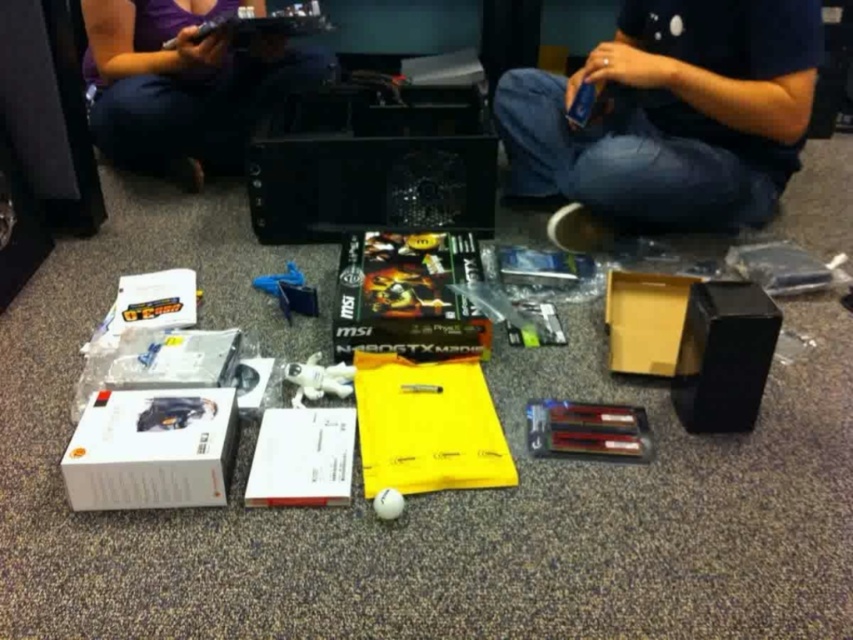
Question: In this image, where is matte purple shirt at upper left located relative to white plastic astronaut at center?

Choices:
 (A) right
 (B) left

Answer: (B)

Question: Estimate the real-world distances between objects in this image. Which object is farther from the blue plastic toy at center?

Choices:
 (A) blue denim jeans at lower right
 (B) matte purple shirt at upper left
 (C) white rubber ball at center

Answer: (A)

Question: Which point appears farthest from the camera in this image?

Choices:
 (A) (396, 493)
 (B) (730, 125)

Answer: (B)

Question: Which is nearer to the matte purple shirt at upper left?

Choices:
 (A) white plastic astronaut at center
 (B) blue plastic toy at center
 (C) white rubber ball at center
 (D) blue denim jeans at lower right

Answer: (B)

Question: Can you confirm if blue denim jeans at lower right is bigger than white rubber ball at center?

Choices:
 (A) yes
 (B) no

Answer: (A)

Question: Is blue plastic toy at center smaller than white rubber ball at center?

Choices:
 (A) yes
 (B) no

Answer: (B)